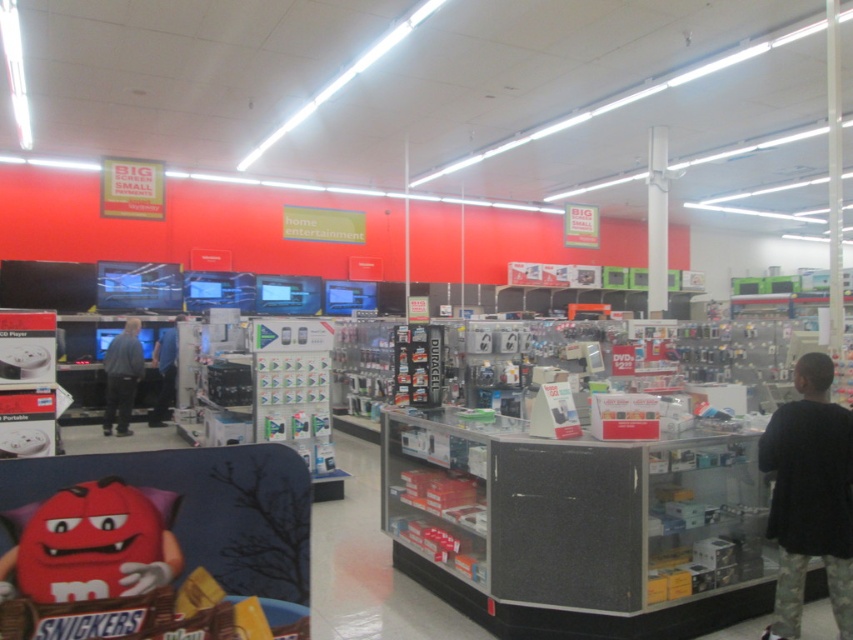
Is black matte shirt at right shorter than dark blue jeans at center?

Indeed, black matte shirt at right has a lesser height compared to dark blue jeans at center.

The height and width of the screenshot is (640, 853). What do you see at coordinates (809, 496) in the screenshot?
I see `black matte shirt at right` at bounding box center [809, 496].

The height and width of the screenshot is (640, 853). I want to click on black matte shirt at right, so click(809, 496).

Does black matte shirt at right have a lesser height compared to matte plastic m&m's character at lower left?

No.

Can you confirm if black matte shirt at right is positioned to the left of matte plastic m&m's character at lower left?

In fact, black matte shirt at right is to the right of matte plastic m&m's character at lower left.

Who is more forward, (x=788, y=460) or (x=138, y=576)?

Point (x=138, y=576)

In order to click on black matte shirt at right in this screenshot , I will do `click(809, 496)`.

Measure the distance from blue fabric shirt at left to dark blue jeans at center.

blue fabric shirt at left and dark blue jeans at center are 29.32 inches apart.

Is blue fabric shirt at left to the left of dark blue jeans at center from the viewer's perspective?

Correct, you'll find blue fabric shirt at left to the left of dark blue jeans at center.

Which is in front, point (114, 417) or point (171, 346)?

Point (114, 417) is more forward.

Find the location of a particular element. The width and height of the screenshot is (853, 640). blue fabric shirt at left is located at coordinates (122, 378).